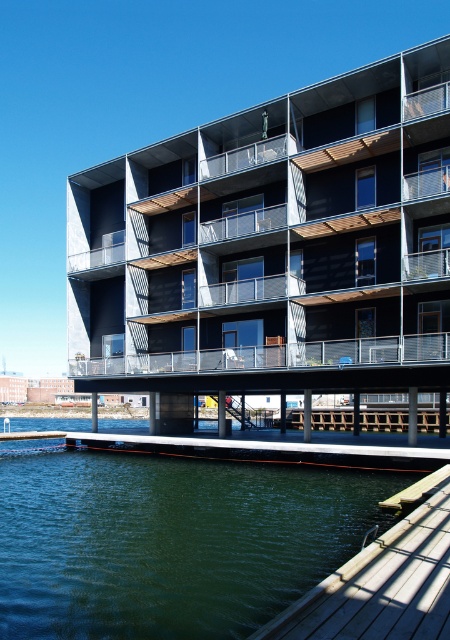
The width and height of the screenshot is (450, 640). What do you see at coordinates (273, 250) in the screenshot?
I see `wooden dock at lower center` at bounding box center [273, 250].

This screenshot has height=640, width=450. I want to click on wooden dock at lower center, so click(273, 250).

Does point (394, 195) lie behind point (342, 525)?

Yes, point (394, 195) is farther from viewer.

Where is `wooden dock at lower center`? The width and height of the screenshot is (450, 640). wooden dock at lower center is located at coordinates [x=273, y=250].

Between green water at lower left and wooden dock at lower right, which one is positioned lower?

green water at lower left is below.

Is point (140, 500) farther from viewer compared to point (370, 636)?

Yes.

Is point (234, 490) positioned before point (404, 572)?

No.

I want to click on green water at lower left, so click(170, 540).

From the picture: How far apart are wooden dock at lower center and wooden dock at lower right?

wooden dock at lower center is 13.84 meters from wooden dock at lower right.

Is point (203, 179) closer to camera compared to point (445, 605)?

No, (203, 179) is behind (445, 605).

Locate an element on the screen. The width and height of the screenshot is (450, 640). wooden dock at lower center is located at coordinates (273, 250).